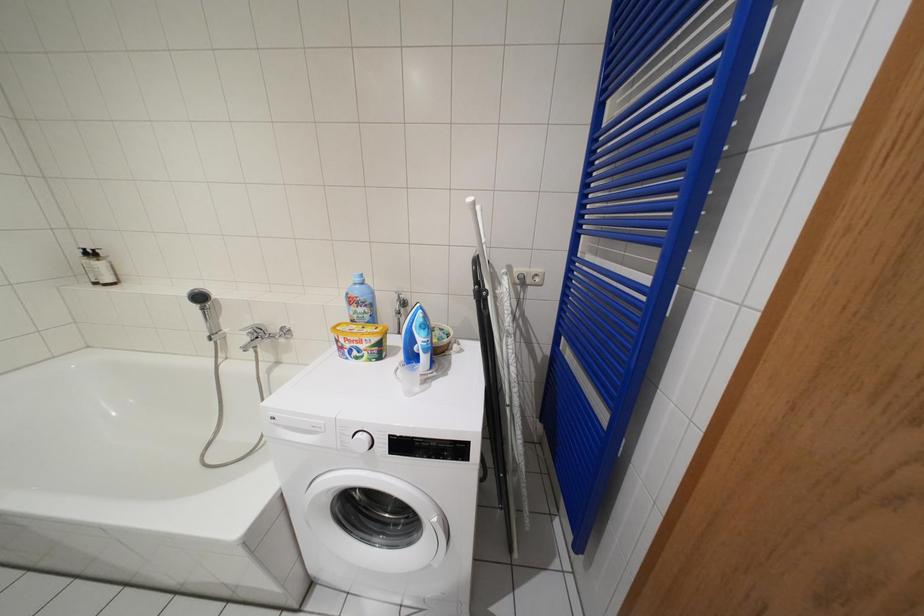
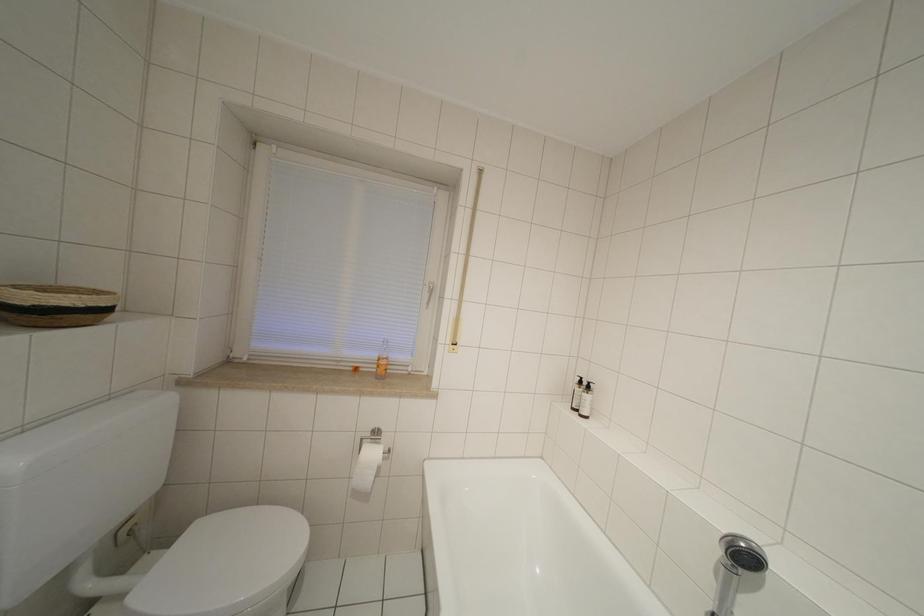
Question: The camera is either moving clockwise (left) or counter-clockwise (right) around the object. The first image is from the beginning of the video and the second image is from the end. Is the camera moving left or right when shooting the video?

Choices:
 (A) Left
 (B) Right

Answer: (B)